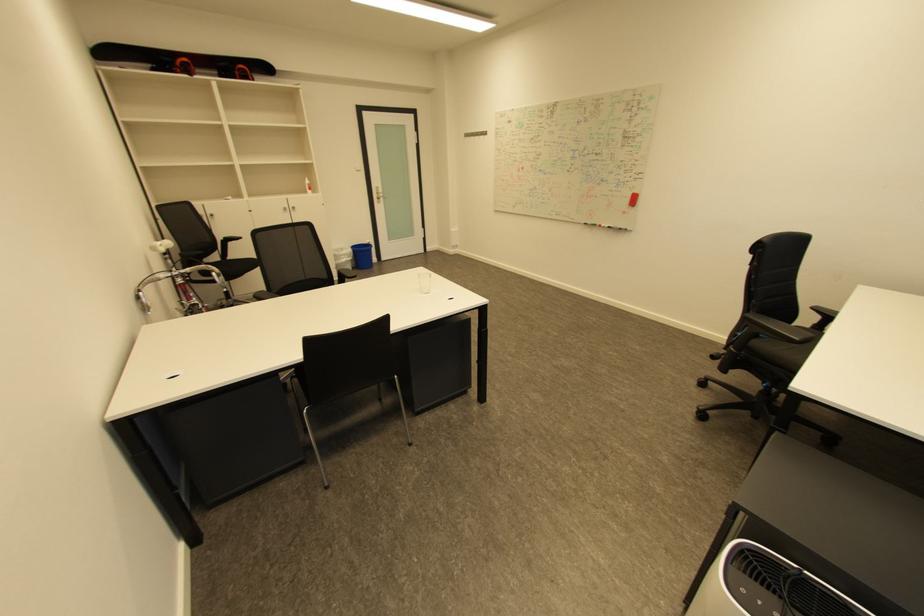
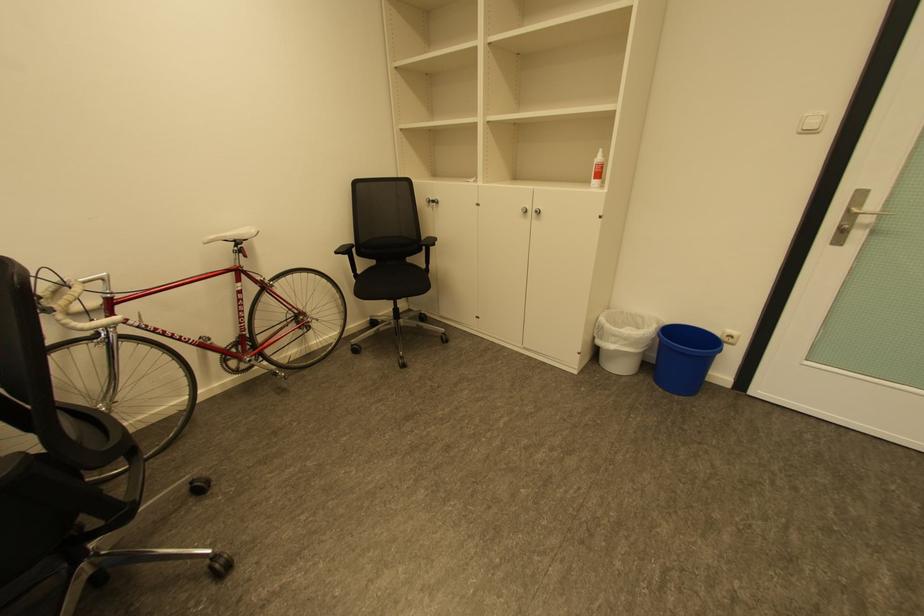
Where in the second image is the point corresponding to the point at 377,244 from the first image?

(737, 337)